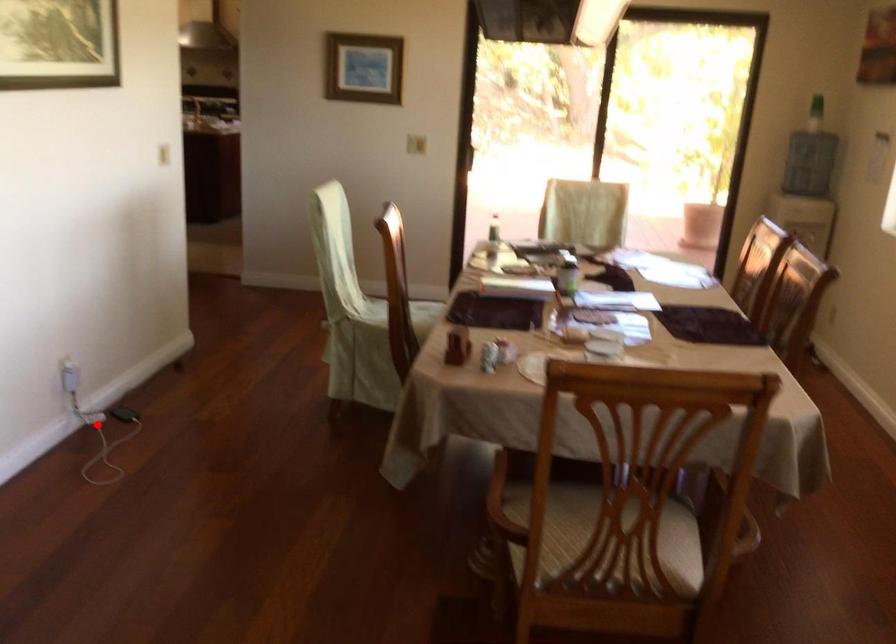
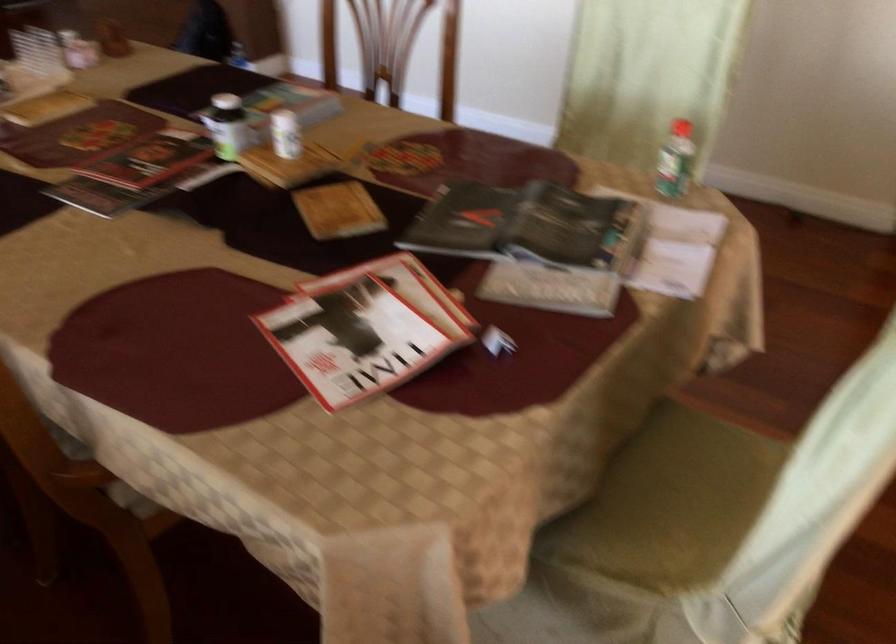
Question: I am providing you with two images of the same scene from different viewpoints. A red point is marked on the first image. Is the red point's position out of view in image 2?

Choices:
 (A) Yes
 (B) No

Answer: (A)